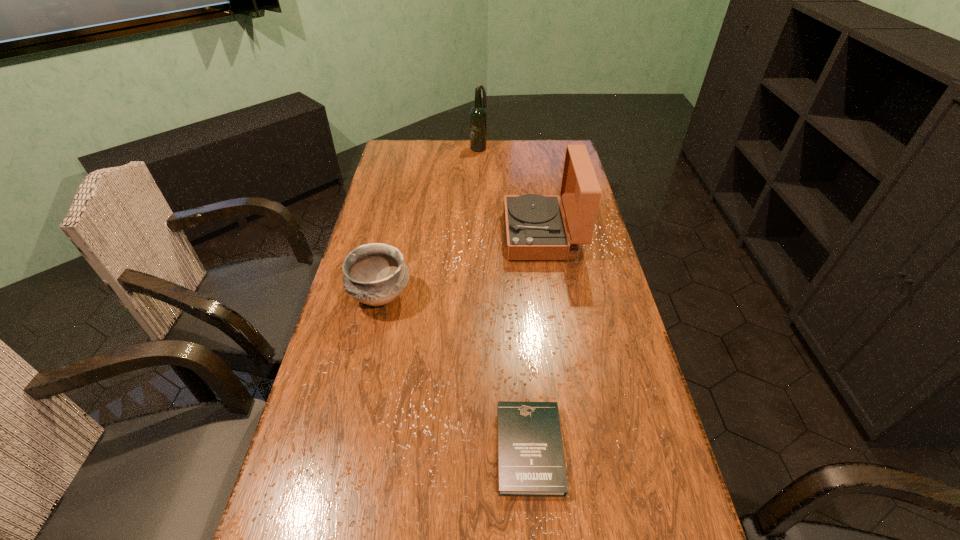
This screenshot has width=960, height=540. I want to click on vacant space that is in between the leftmost object and the farthest object, so click(x=430, y=222).

Select which object appears as the closest to the third farthest object. Please provide its 2D coordinates. Your answer should be formatted as a tuple, i.e. [(x, y)], where the tuple contains the x and y coordinates of a point satisfying the conditions above.

[(535, 229)]

Where is `the second closest object relative to the beer bottle`? the second closest object relative to the beer bottle is located at coordinates (375, 274).